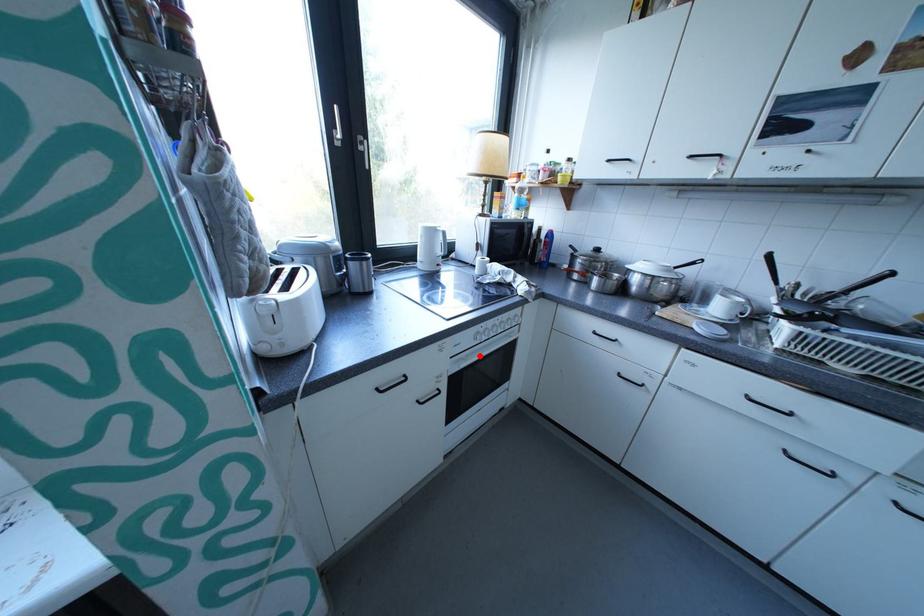
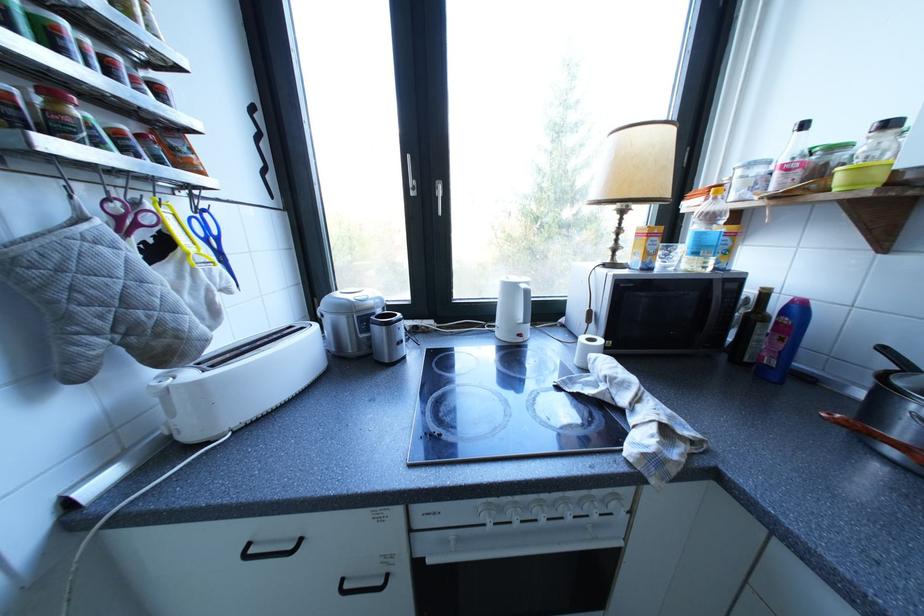
Where in the second image is the point corresponding to the highlighted location from the first image?

(470, 540)